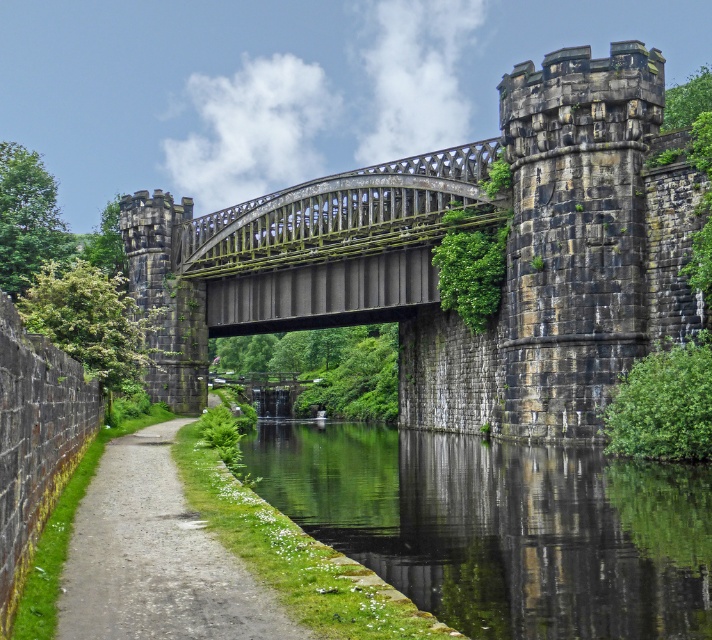
Question: Can you confirm if stone castle at center is positioned above dirt/gravel path at lower left?

Choices:
 (A) no
 (B) yes

Answer: (B)

Question: Does stone castle at center lie in front of green mossy stone bridge at center?

Choices:
 (A) yes
 (B) no

Answer: (A)

Question: Considering the real-world distances, which object is closest to the dirt/gravel path at lower left?

Choices:
 (A) green reflective water at center
 (B) stone castle at center

Answer: (A)

Question: Which point is farther to the camera?

Choices:
 (A) (538, 381)
 (B) (193, 403)
 (C) (209, 538)
 (D) (288, 484)

Answer: (B)

Question: Does stone castle at center have a greater width compared to green mossy stone bridge at center?

Choices:
 (A) yes
 (B) no

Answer: (A)

Question: Which is nearer to the green reflective water at center?

Choices:
 (A) green mossy stone bridge at center
 (B) dirt/gravel path at lower left

Answer: (B)